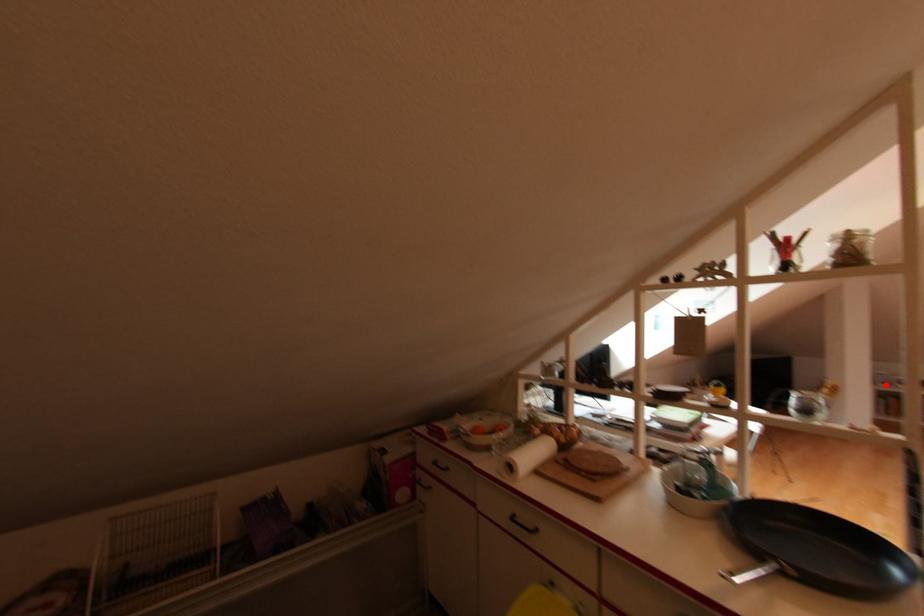
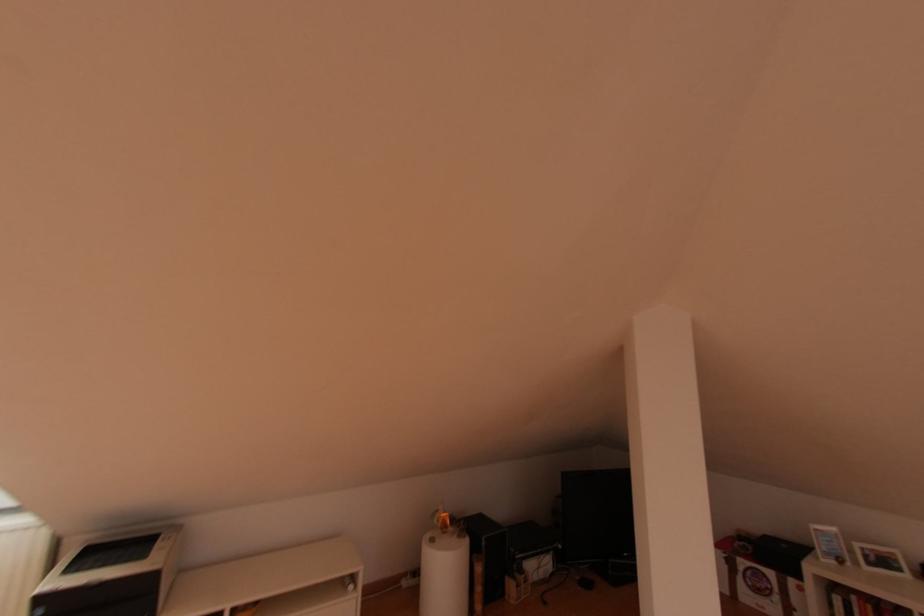
Find the pixel in the second image that matches the highlighted location in the first image.

(840, 562)